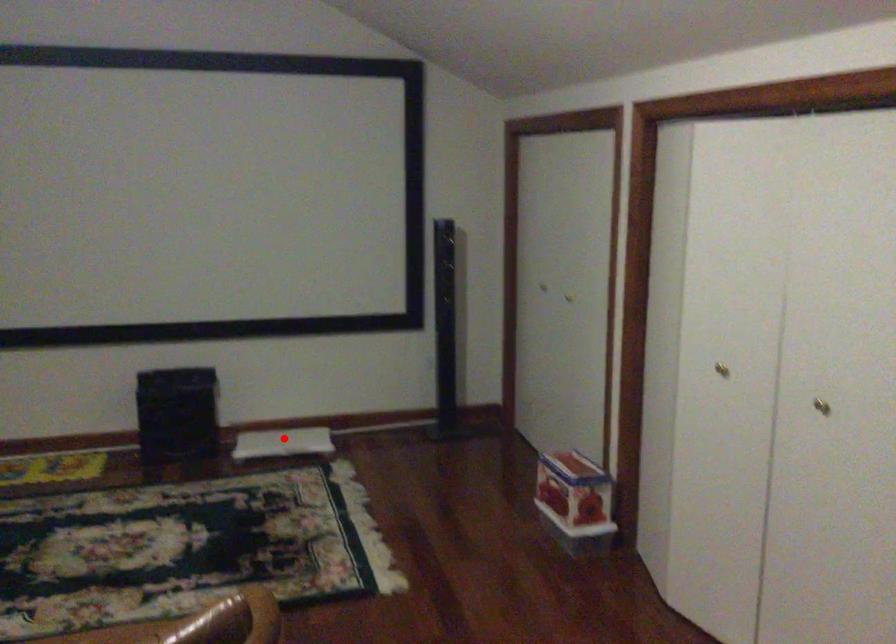
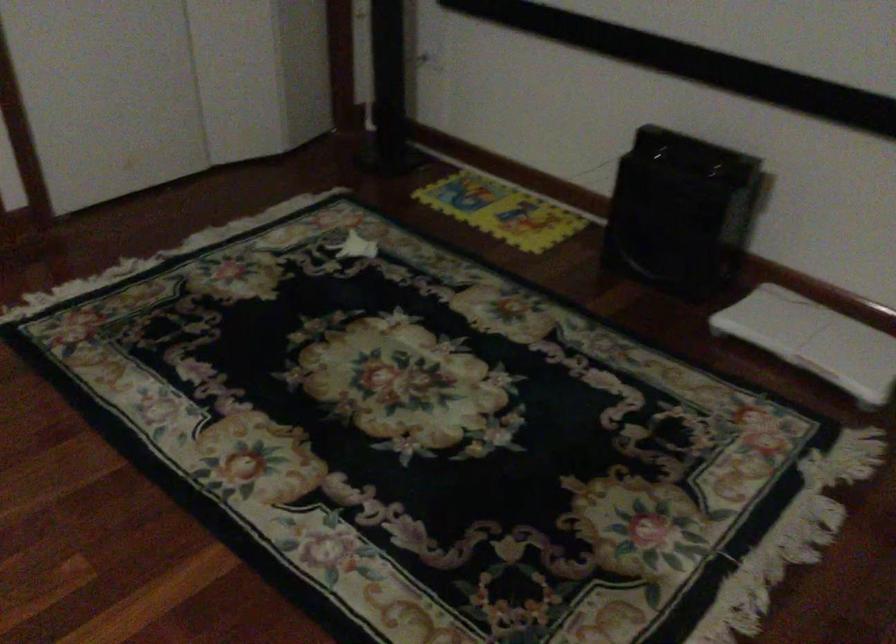
Where in the second image is the point corresponding to the highlighted location from the first image?

(814, 339)